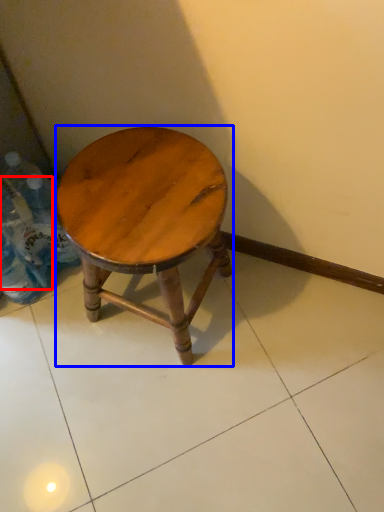
Question: Which of the following is the closest to the observer, bottle (highlighted by a red box) or stool (highlighted by a blue box)?

Choices:
 (A) bottle
 (B) stool

Answer: (B)